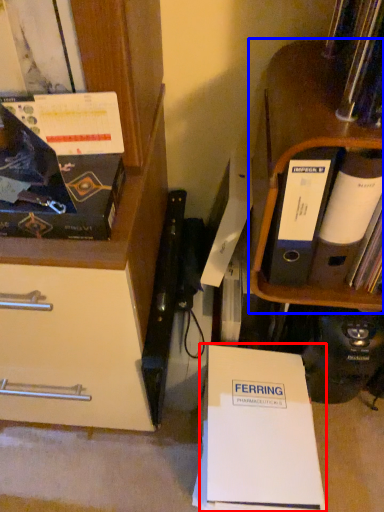
Question: Among these objects, which one is nearest to the camera, paperback book (highlighted by a red box) or shelf (highlighted by a blue box)?

Choices:
 (A) paperback book
 (B) shelf

Answer: (B)